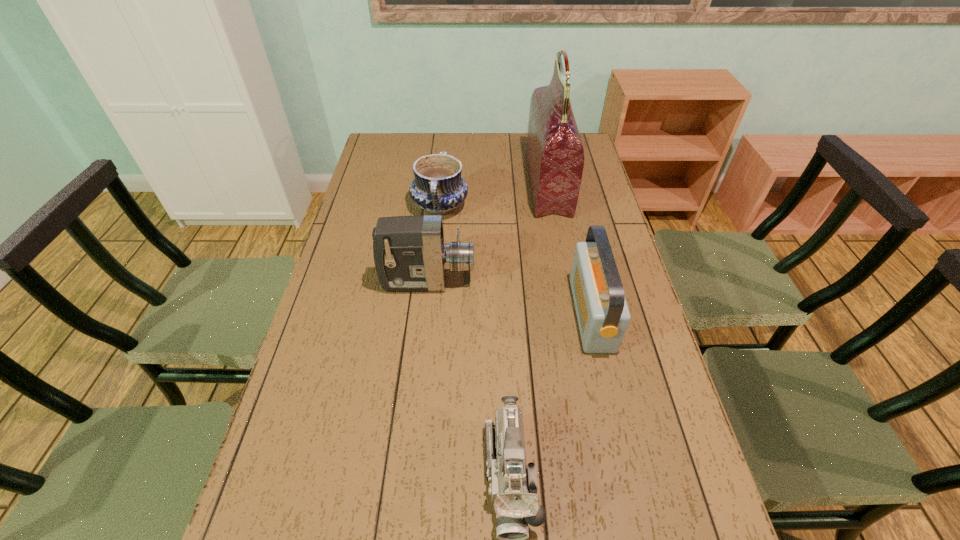
Find the location of a particular element. handbag is located at coordinates (555, 155).

Image resolution: width=960 pixels, height=540 pixels. I want to click on the left camcorder, so [410, 255].

Where is `the taller camcorder`? The width and height of the screenshot is (960, 540). the taller camcorder is located at coordinates (410, 255).

Locate an element on the screen. radio receiver is located at coordinates (603, 315).

Where is `pottery`? pottery is located at coordinates (438, 188).

This screenshot has height=540, width=960. Find the location of `vacant position located on the front-facing side of the handbag`. vacant position located on the front-facing side of the handbag is located at coordinates (451, 184).

Find the location of `blank area located on the front-facing side of the handbag`. blank area located on the front-facing side of the handbag is located at coordinates (453, 184).

Image resolution: width=960 pixels, height=540 pixels. What are the coordinates of `free location located 0.330m on the front-facing side of the handbag` in the screenshot? It's located at (443, 184).

Identify the location of vacant space located 0.240m at the front of the farther camcorder, highlighting the lens. The height and width of the screenshot is (540, 960). (554, 282).

You are a GUI agent. You are given a task and a screenshot of the screen. Output one action in this format:
    pyautogui.click(x=<x>, y=<y>)
    Task: Click on the vacant point located on the front-facing side of the radio receiver
    
    Given the screenshot: What is the action you would take?
    pyautogui.click(x=540, y=314)